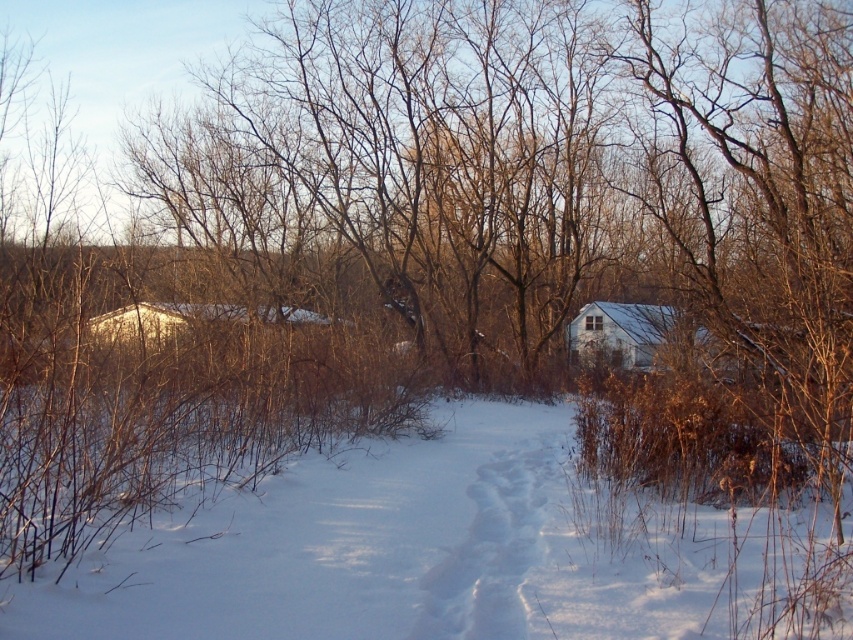
Question: Can you confirm if white powdery snow at center is positioned above white matte house at center?

Choices:
 (A) yes
 (B) no

Answer: (B)

Question: Is white powdery snow at center below white matte house at center?

Choices:
 (A) no
 (B) yes

Answer: (B)

Question: Which point is closer to the camera?

Choices:
 (A) (572, 456)
 (B) (657, 310)

Answer: (A)

Question: Does white powdery snow at center appear over white matte house at center?

Choices:
 (A) yes
 (B) no

Answer: (B)

Question: Which of the following is the closest to the observer?

Choices:
 (A) (383, 616)
 (B) (660, 317)

Answer: (A)